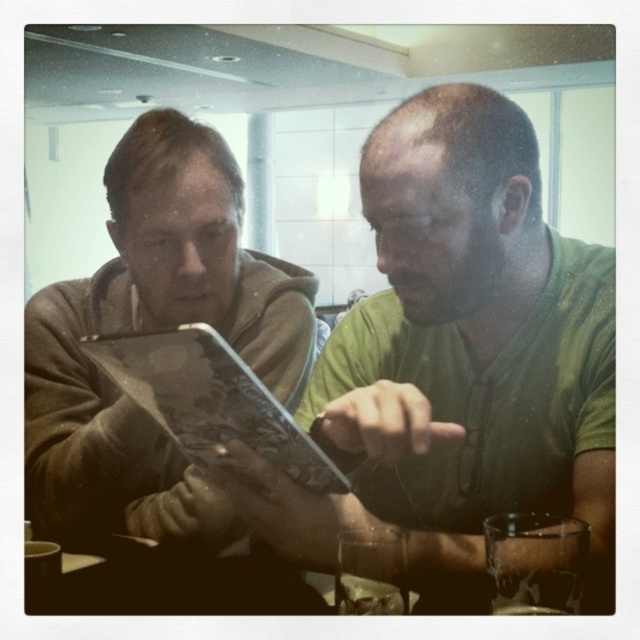
Is point (550, 483) positioned in front of point (260, 448)?

No, it is behind (260, 448).

Who is taller, green matte shirt at center or matte black tablet at center?

green matte shirt at center

Does point (545, 268) come in front of point (236, 408)?

No, it is not.

Find the location of a particular element. green matte shirt at center is located at coordinates (456, 358).

Who is shorter, green matte shirt at center or matte brown hoodie at left?

Standing shorter between the two is green matte shirt at center.

Which is in front, point (342, 467) or point (180, 132)?

Point (342, 467)

Find the location of `green matte shirt at center`. green matte shirt at center is located at coordinates (456, 358).

Which is more to the right, matte brown hoodie at left or matte black tablet at center?

Positioned to the right is matte black tablet at center.

Is matte brown hoodie at left below matte black tablet at center?

Actually, matte brown hoodie at left is above matte black tablet at center.

You are a GUI agent. You are given a task and a screenshot of the screen. Output one action in this format:
    pyautogui.click(x=<x>, y=<y>)
    Task: Click on the matte brown hoodie at left
    The height and width of the screenshot is (640, 640).
    Given the screenshot: What is the action you would take?
    pyautogui.click(x=154, y=328)

At what (x,y) coordinates should I click in order to perform the action: click on matte brown hoodie at left. Please return your answer as a coordinate pair (x, y). The width and height of the screenshot is (640, 640). Looking at the image, I should click on (154, 328).